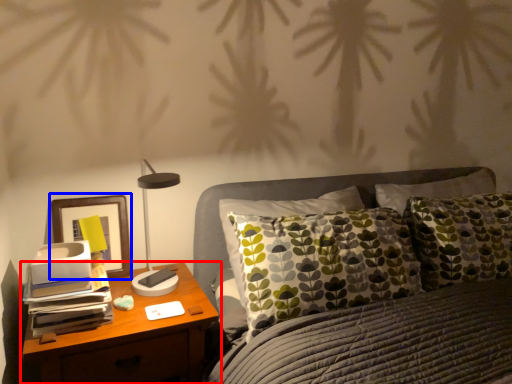
Question: Which object appears farthest to the camera in this image, nightstand (highlighted by a red box) or picture frame (highlighted by a blue box)?

Choices:
 (A) nightstand
 (B) picture frame

Answer: (B)